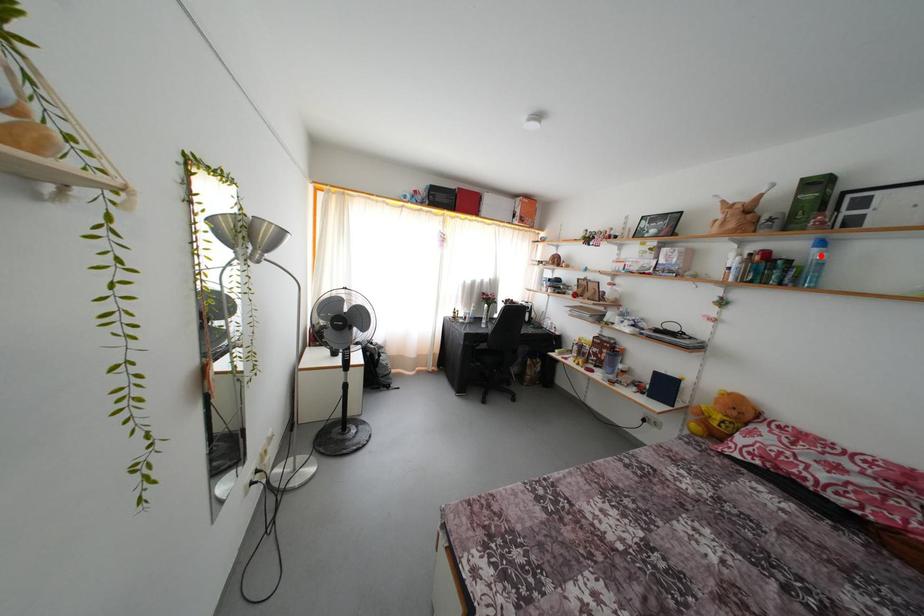
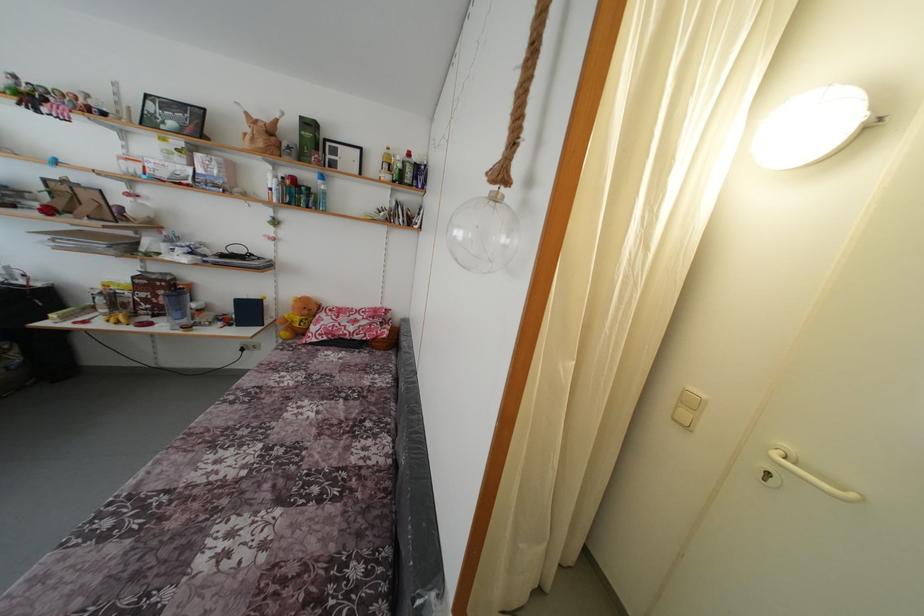
Question: I am providing you with two images of the same scene from different viewpoints. A red point is marked on the first image. Can you still see the location of the red point in image 2?

Choices:
 (A) Yes
 (B) No

Answer: (A)